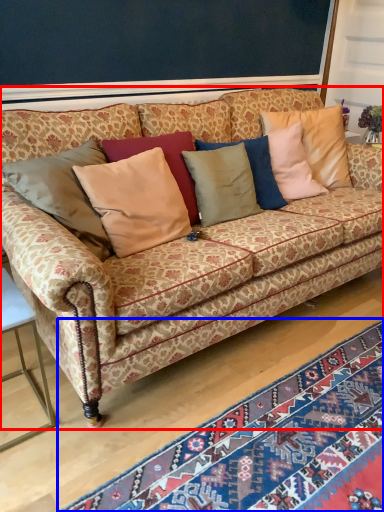
Question: Which object is further to the camera taking this photo, studio couch (highlighted by a red box) or mat (highlighted by a blue box)?

Choices:
 (A) studio couch
 (B) mat

Answer: (A)